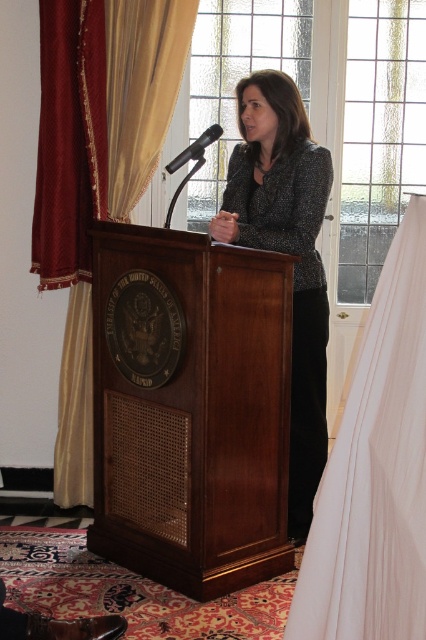
How distant is silky gold curtain at left from black metallic microphone at center?

silky gold curtain at left is 24.86 inches from black metallic microphone at center.

How much distance is there between silky gold curtain at left and black metallic microphone at center?

silky gold curtain at left and black metallic microphone at center are 63.15 centimeters apart.

Does point (176, 81) lie behind point (184, 156)?

Yes, point (176, 81) is behind point (184, 156).

The width and height of the screenshot is (426, 640). Identify the location of silky gold curtain at left. (140, 92).

Does black textured blazer at center appear on the right side of silky gold curtain at left?

Yes, black textured blazer at center is to the right of silky gold curtain at left.

What do you see at coordinates (285, 252) in the screenshot? The width and height of the screenshot is (426, 640). I see `black textured blazer at center` at bounding box center [285, 252].

Identify the location of black textured blazer at center. This screenshot has width=426, height=640. (285, 252).

Where is `black textured blazer at center`? The image size is (426, 640). black textured blazer at center is located at coordinates (285, 252).

Does mahogany wood podium at center have a smaller size compared to black textured blazer at center?

No.

How much distance is there between mahogany wood podium at center and black textured blazer at center?

mahogany wood podium at center and black textured blazer at center are 45.91 centimeters apart.

Does point (155, 477) lie in front of point (319, 429)?

Yes, it is in front of point (319, 429).

In order to click on mahogany wood podium at center in this screenshot , I will do `click(190, 408)`.